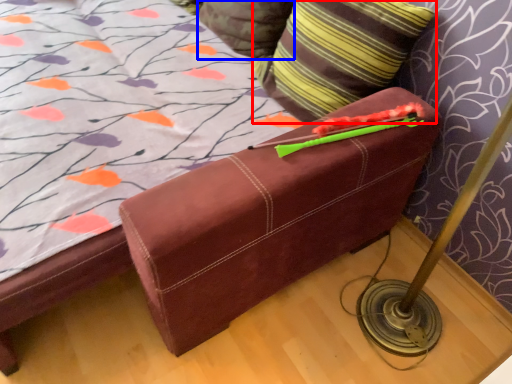
Question: Which point is further to the camera, pillow (highlighted by a red box) or pillow (highlighted by a blue box)?

Choices:
 (A) pillow
 (B) pillow

Answer: (B)